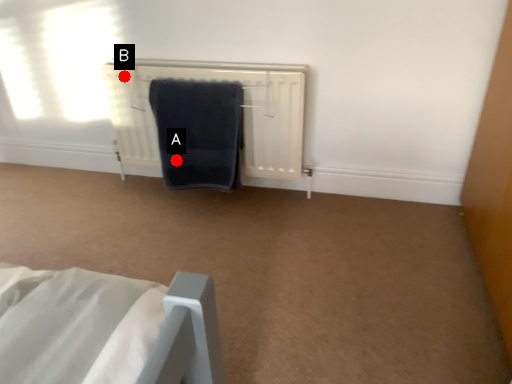
Question: Two points are circled on the image, labeled by A and B beside each circle. Which point is farther to the camera?

Choices:
 (A) A is further
 (B) B is further

Answer: (A)